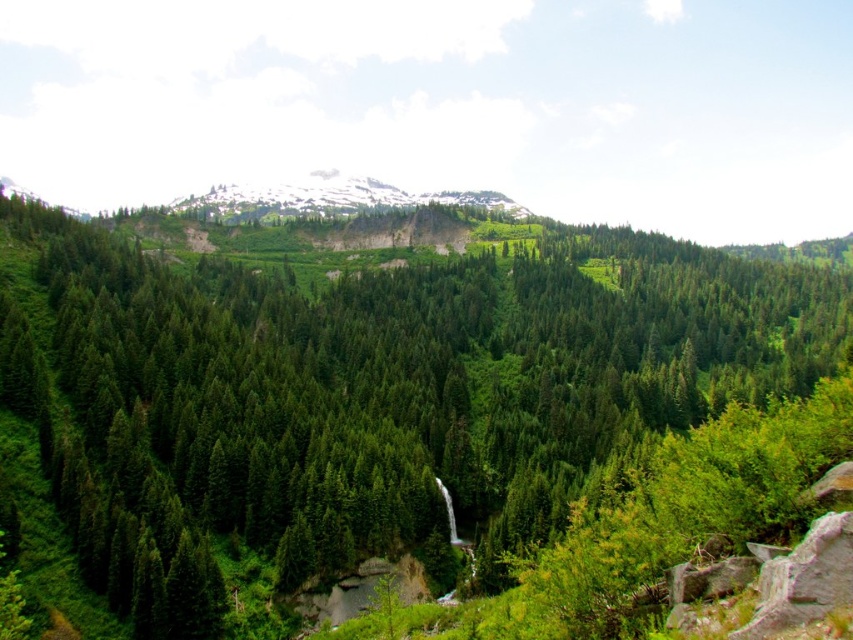
Looking at this image, who is positioned more to the right, green matte tree at center or snowy rocky mountain at upper center?

green matte tree at center is more to the right.

Describe the element at coordinates (370, 396) in the screenshot. I see `green matte tree at center` at that location.

Identify the location of green matte tree at center. Image resolution: width=853 pixels, height=640 pixels. (370, 396).